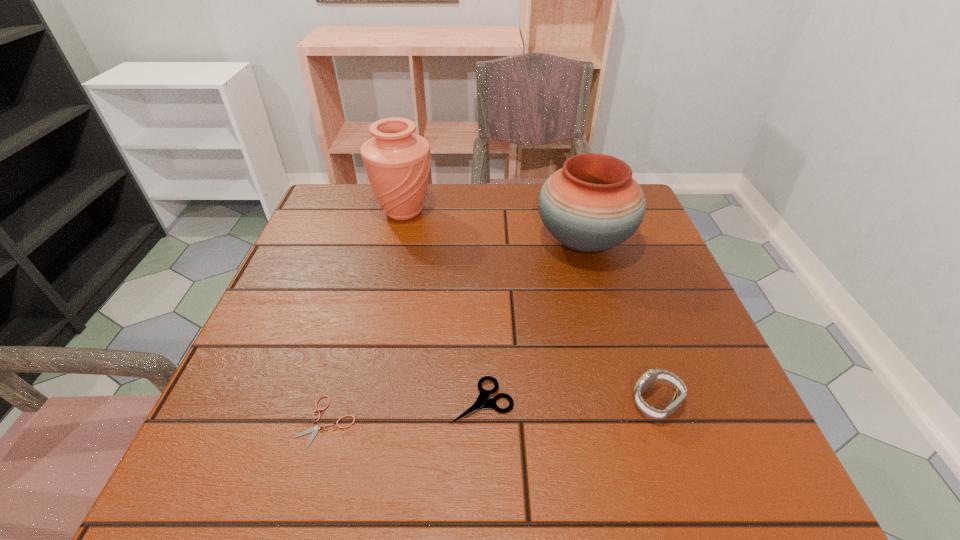
Locate an element on the screen. The image size is (960, 540). the tallest object is located at coordinates (397, 162).

This screenshot has width=960, height=540. What are the coordinates of `pottery` in the screenshot? It's located at (592, 204).

Find the location of `the third tallest object`. the third tallest object is located at coordinates (651, 376).

At what (x,y) coordinates should I click in order to perform the action: click on the right shears. Please return your answer as a coordinate pair (x, y). The image size is (960, 540). Looking at the image, I should click on (482, 402).

The image size is (960, 540). I want to click on the third object from right to left, so click(x=482, y=402).

You are a GUI agent. You are given a task and a screenshot of the screen. Output one action in this format:
    pyautogui.click(x=<x>, y=<y>)
    Task: Click on the shorter shears
    
    Given the screenshot: What is the action you would take?
    pyautogui.click(x=315, y=428)

In order to click on the left shears in this screenshot , I will do `click(315, 428)`.

This screenshot has height=540, width=960. Find the location of `vacant space located on the front of the tallest object`. vacant space located on the front of the tallest object is located at coordinates (383, 303).

Find the location of a particular element. The image size is (960, 540). free space located 0.100m on the front of the second tallest object is located at coordinates (602, 305).

This screenshot has width=960, height=540. In order to click on vacant space located on the face of the third shortest object in this screenshot , I will do `click(597, 402)`.